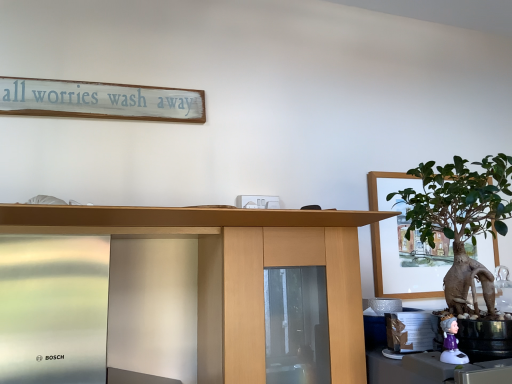
Question: Considering their positions, is white painted wood signboard at upper center located in front of or behind wooden desk at center?

Choices:
 (A) behind
 (B) front

Answer: (A)

Question: Looking at the image, does white painted wood signboard at upper center seem bigger or smaller compared to wooden desk at center?

Choices:
 (A) big
 (B) small

Answer: (B)

Question: Based on their relative distances, which object is nearer to the wooden desk at center?

Choices:
 (A) green matte houseplant at right
 (B) white plastic figurine at lower right
 (C) white painted wood signboard at upper center

Answer: (A)

Question: Which object is positioned farthest from the green matte houseplant at right?

Choices:
 (A) wooden desk at center
 (B) white painted wood signboard at upper center
 (C) white plastic figurine at lower right

Answer: (B)